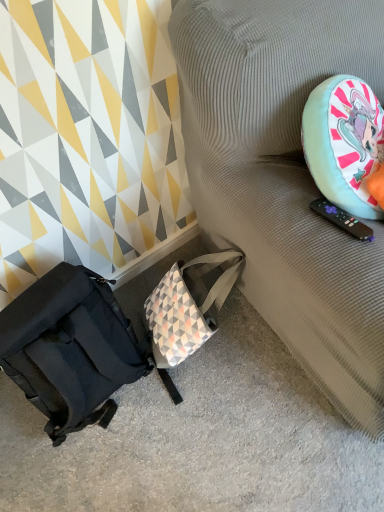
Question: Should I look upward or downward to see textured fabric couch at right?

Choices:
 (A) up
 (B) down

Answer: (A)

Question: Is textured fabric couch at right turned away from matte black backpack at lower left?

Choices:
 (A) no
 (B) yes

Answer: (A)

Question: Is textured fabric couch at right to the left of matte black backpack at lower left from the viewer's perspective?

Choices:
 (A) no
 (B) yes

Answer: (A)

Question: Is textured fabric couch at right taller than matte black backpack at lower left?

Choices:
 (A) no
 (B) yes

Answer: (B)

Question: From a real-world perspective, is textured fabric couch at right located beneath matte black backpack at lower left?

Choices:
 (A) no
 (B) yes

Answer: (A)

Question: Can you see textured fabric couch at right touching matte black backpack at lower left?

Choices:
 (A) yes
 (B) no

Answer: (B)

Question: Considering the relative sizes of textured fabric couch at right and matte black backpack at lower left in the image provided, is textured fabric couch at right shorter than matte black backpack at lower left?

Choices:
 (A) yes
 (B) no

Answer: (B)

Question: Does matte black backpack at lower left have a greater width compared to textured fabric couch at right?

Choices:
 (A) no
 (B) yes

Answer: (A)

Question: Does matte black backpack at lower left appear on the left side of textured fabric couch at right?

Choices:
 (A) yes
 (B) no

Answer: (A)

Question: Is matte black backpack at lower left turned away from textured fabric couch at right?

Choices:
 (A) yes
 (B) no

Answer: (B)

Question: Is matte black backpack at lower left shorter than textured fabric couch at right?

Choices:
 (A) yes
 (B) no

Answer: (A)

Question: Is matte black backpack at lower left not within textured fabric couch at right?

Choices:
 (A) yes
 (B) no

Answer: (A)

Question: Is matte black backpack at lower left in contact with textured fabric couch at right?

Choices:
 (A) no
 (B) yes

Answer: (A)

Question: In terms of size, does matte black backpack at lower left appear bigger or smaller than textured fabric couch at right?

Choices:
 (A) small
 (B) big

Answer: (A)